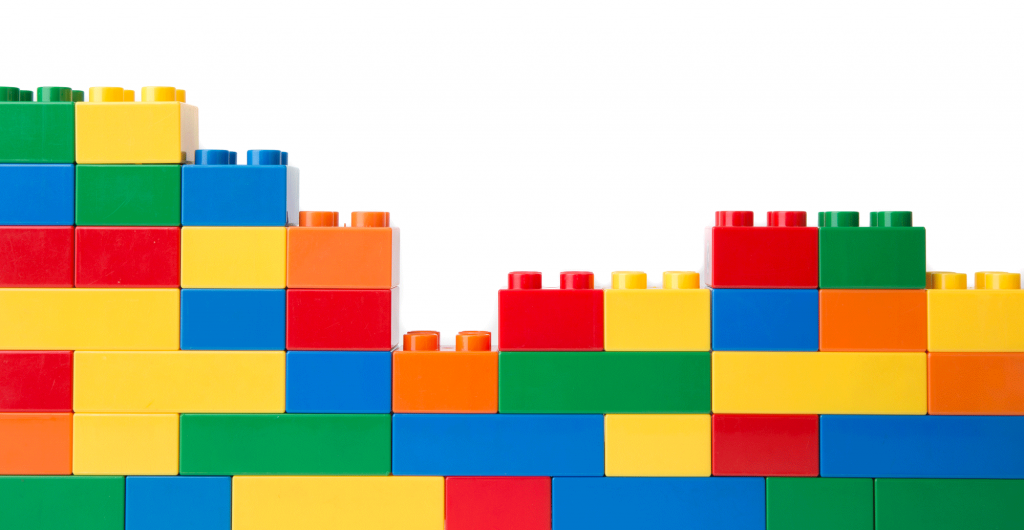
You are a GUI agent. You are given a task and a screenshot of the screen. Output one action in this format:
    pyautogui.click(x=<x>, y=<y>)
    Task: Click on the blue plastic building blocks
    The image size is (1024, 530).
    Given the screenshot: What is the action you would take?
    pyautogui.click(x=49, y=193), pyautogui.click(x=226, y=323), pyautogui.click(x=244, y=189), pyautogui.click(x=185, y=501), pyautogui.click(x=334, y=375), pyautogui.click(x=485, y=434), pyautogui.click(x=616, y=496), pyautogui.click(x=769, y=320), pyautogui.click(x=897, y=435)